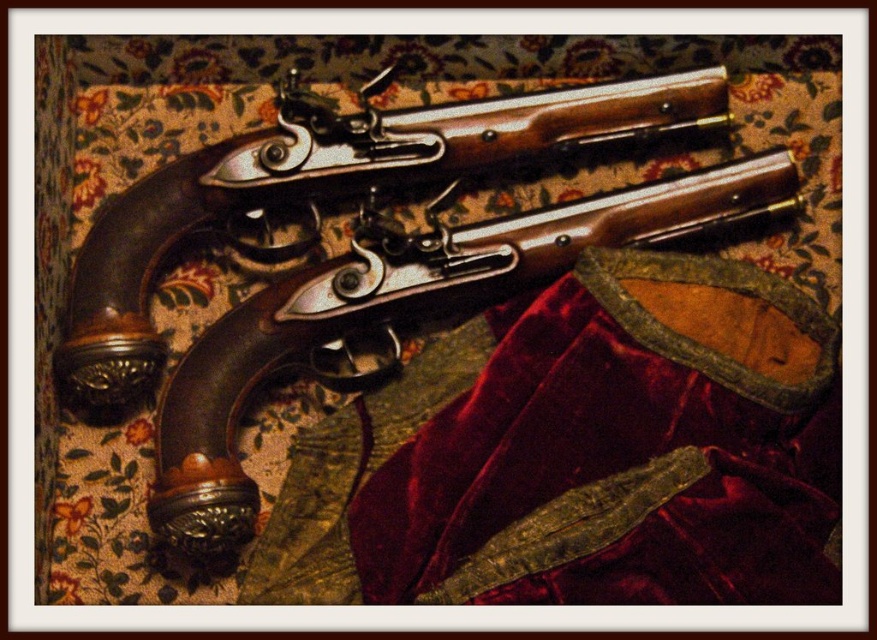
Question: Which point is farther to the camera?

Choices:
 (A) brown polished wood shotgun at center
 (B) polished wood shotgun at center

Answer: (B)

Question: Can you confirm if polished wood shotgun at center is thinner than brown polished wood shotgun at center?

Choices:
 (A) no
 (B) yes

Answer: (A)

Question: Which point is farther from the camera taking this photo?

Choices:
 (A) (322, 128)
 (B) (460, 240)

Answer: (A)

Question: Can you confirm if polished wood shotgun at center is bigger than brown polished wood shotgun at center?

Choices:
 (A) yes
 (B) no

Answer: (A)

Question: Considering the relative positions of polished wood shotgun at center and brown polished wood shotgun at center in the image provided, where is polished wood shotgun at center located with respect to brown polished wood shotgun at center?

Choices:
 (A) left
 (B) right

Answer: (A)

Question: Which of the following is the farthest from the observer?

Choices:
 (A) brown polished wood shotgun at center
 (B) polished wood shotgun at center

Answer: (B)